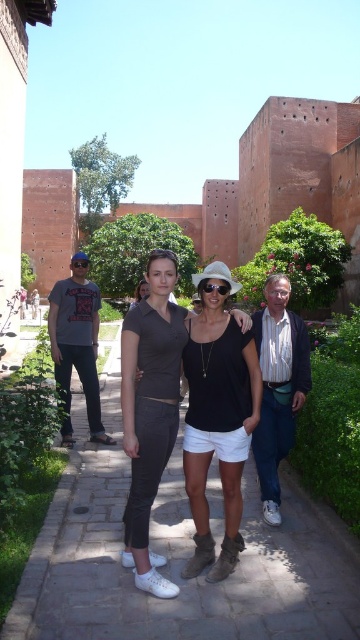
What is the object located at the coordinates point (177, 564) in the image?

The object located at point (177, 564) is the paved stone path at center.